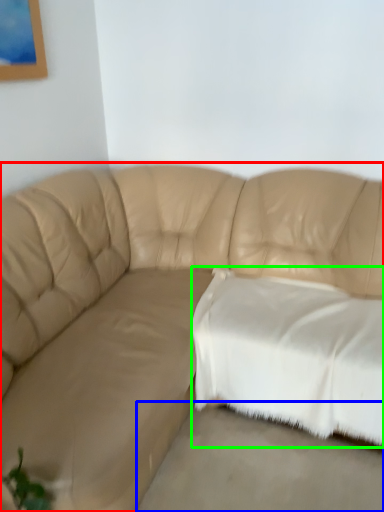
Question: Which object is positioned farthest from studio couch (highlighted by a red box)? Select from concrete (highlighted by a blue box) and pillow (highlighted by a green box).

Choices:
 (A) concrete
 (B) pillow

Answer: (A)